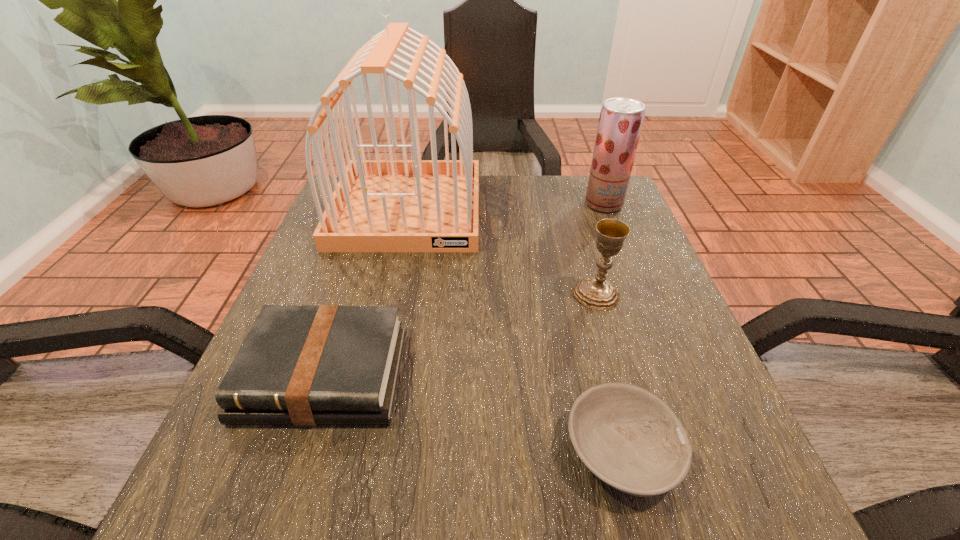
I want to click on object located at the far right corner, so click(x=621, y=119).

You are a GUI agent. You are given a task and a screenshot of the screen. Output one action in this format:
    pyautogui.click(x=<x>, y=<y>)
    Task: Click on the object located at the near right corner
    The width and height of the screenshot is (960, 540).
    Given the screenshot: What is the action you would take?
    pyautogui.click(x=629, y=438)

This screenshot has height=540, width=960. In the image, there is a desktop. Find the location of `vacant space at the far edge`. vacant space at the far edge is located at coordinates (504, 202).

Identify the location of vacant space at the left edge of the desktop. Image resolution: width=960 pixels, height=540 pixels. (383, 253).

Find the location of `vacant area at the right edge`. vacant area at the right edge is located at coordinates point(642,229).

Identify the location of free region at the near left corner. (286, 508).

The image size is (960, 540). I want to click on free space at the far right corner, so click(578, 197).

In the image, there is a desktop. What are the coordinates of `vacant space at the near right corner` in the screenshot? It's located at (702, 503).

Where is `vacant space that's between the hardback book and the bowl`? This screenshot has height=540, width=960. vacant space that's between the hardback book and the bowl is located at coordinates coord(473,413).

This screenshot has width=960, height=540. I want to click on vacant point located between the hardback book and the bowl, so click(x=473, y=413).